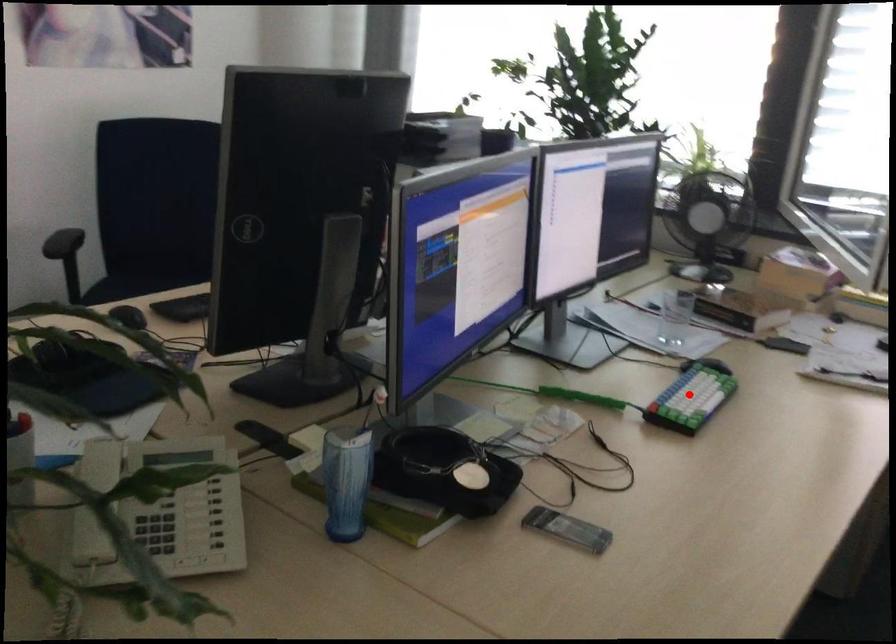
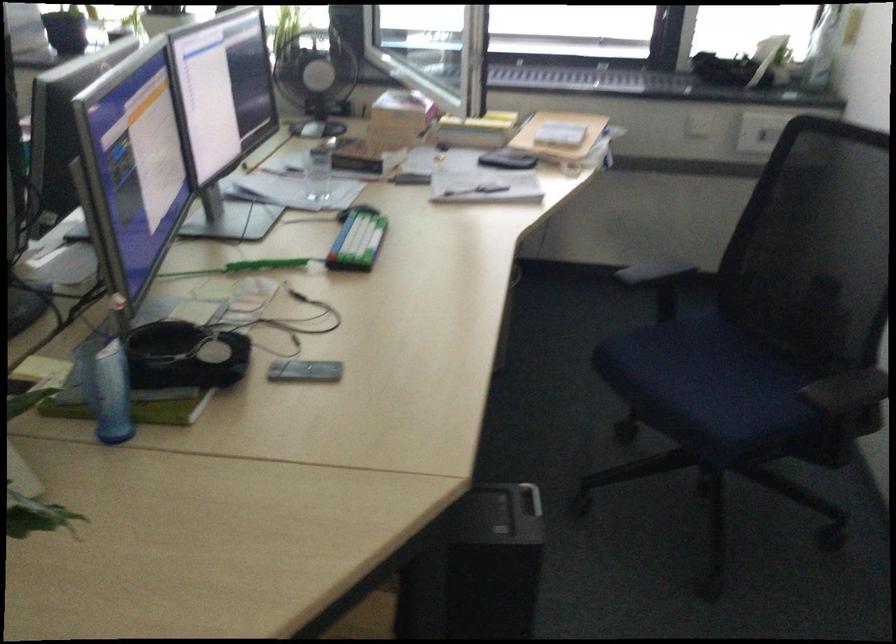
Question: I am providing you with two images of the same scene from different viewpoints. Given a red point in image1, look at the same physical point in image2. Is it:

Choices:
 (A) Closer to the viewpoint
 (B) Farther from the viewpoint

Answer: (B)